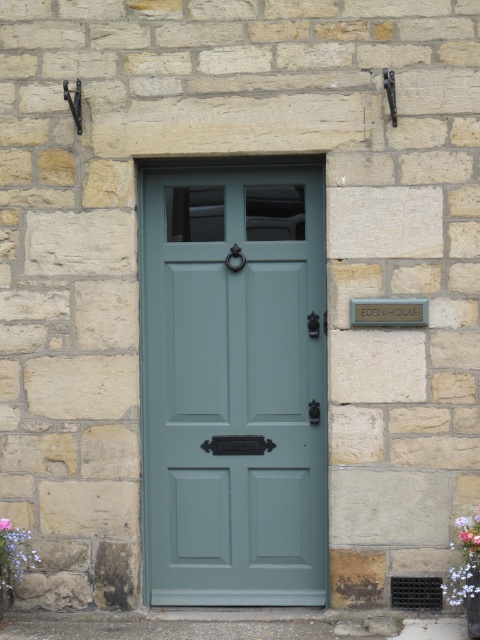
You are a painter holding a 1.2 meter wide canvas. You want to paint the satin green door at center and the purple matte flower at lower left on the same canvas. Can both objects fit side by side without overlapping?

The satin green door at center might be wider than purple matte flower at lower left, so the combined width of both objects could exceed 1.2 meters. It is uncertain if they can fit side by side without overlapping.

You are standing in front of the door and see the purple floral bouquet at lower right and the purple matte flower at lower left. Which one is placed higher on the wall?

The purple floral bouquet at lower right is positioned over the purple matte flower at lower left, so it is placed higher on the wall.